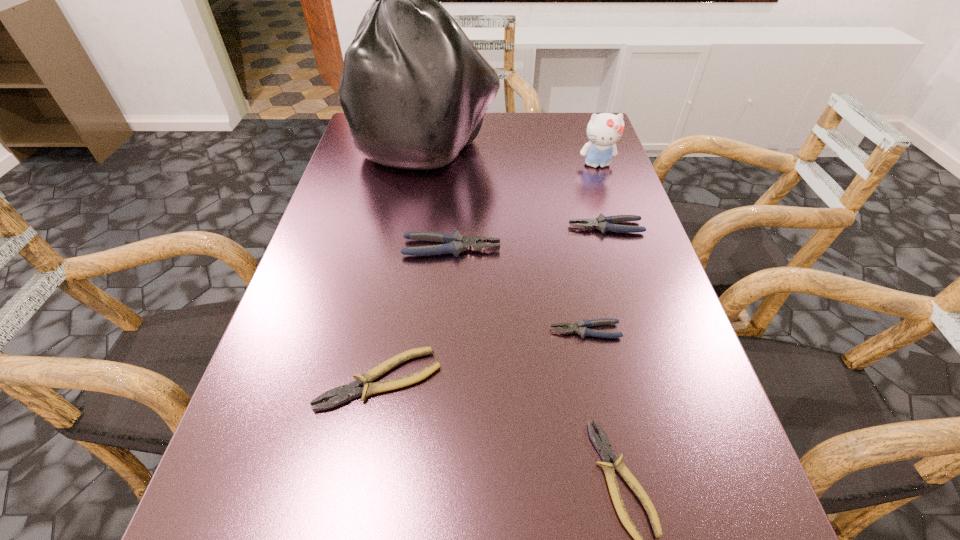
Where is `vacant space in between the nearest gray pliers and the plastic bag`? vacant space in between the nearest gray pliers and the plastic bag is located at coordinates (507, 237).

Where is `vacant space that's between the kitten and the left yellow pliers`? This screenshot has height=540, width=960. vacant space that's between the kitten and the left yellow pliers is located at coordinates (489, 272).

At what (x,y) coordinates should I click in order to perform the action: click on free point between the fourth shortest object and the sixth shortest object. Please return your answer as a coordinate pair (x, y). The height and width of the screenshot is (540, 960). Looking at the image, I should click on [x=601, y=196].

This screenshot has width=960, height=540. I want to click on unoccupied position between the smallest gray pliers and the second tallest object, so click(x=591, y=247).

Choose which object is the fourth nearest neighbor to the fourth shortest object. Please provide its 2D coordinates. Your answer should be formatted as a tuple, i.e. [(x, y)], where the tuple contains the x and y coordinates of a point satisfying the conditions above.

[(580, 327)]

Where is `object that is the second closest to the farthest pliers`? object that is the second closest to the farthest pliers is located at coordinates (604, 130).

Locate an element on the screen. the third closest pliers to the smallest gray pliers is located at coordinates (346, 392).

You are a GUI agent. You are given a task and a screenshot of the screen. Output one action in this format:
    pyautogui.click(x=<x>, y=<y>)
    Task: Click on the pliers object that ranks as the third closest to the third farthest pliers
    This screenshot has height=540, width=960.
    Given the screenshot: What is the action you would take?
    pyautogui.click(x=346, y=392)

This screenshot has height=540, width=960. Find the location of `gray pliers identified as the second closest to the sixth farthest object`. gray pliers identified as the second closest to the sixth farthest object is located at coordinates (456, 243).

Find the location of `gray pliers that is the second closest to the shortest object`. gray pliers that is the second closest to the shortest object is located at coordinates (456, 243).